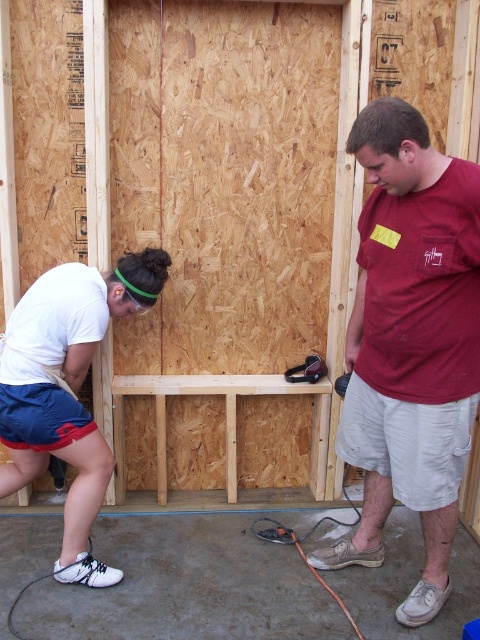
Question: Among these points, which one is nearest to the camera?

Choices:
 (A) (81, 284)
 (B) (411, 612)

Answer: (B)

Question: From the image, what is the correct spatial relationship of maroon t-shirt at center in relation to white matte shirt at lower left?

Choices:
 (A) above
 (B) below

Answer: (A)

Question: Which point is farther to the camera?

Choices:
 (A) (15, 394)
 (B) (373, 394)

Answer: (A)

Question: Considering the relative positions of maroon t-shirt at center and white matte shirt at lower left in the image provided, where is maroon t-shirt at center located with respect to white matte shirt at lower left?

Choices:
 (A) left
 (B) right

Answer: (B)

Question: From the image, what is the correct spatial relationship of maroon t-shirt at center in relation to white matte shirt at lower left?

Choices:
 (A) below
 (B) above

Answer: (B)

Question: Which point is closer to the camera?

Choices:
 (A) (444, 170)
 (B) (29, 458)

Answer: (A)